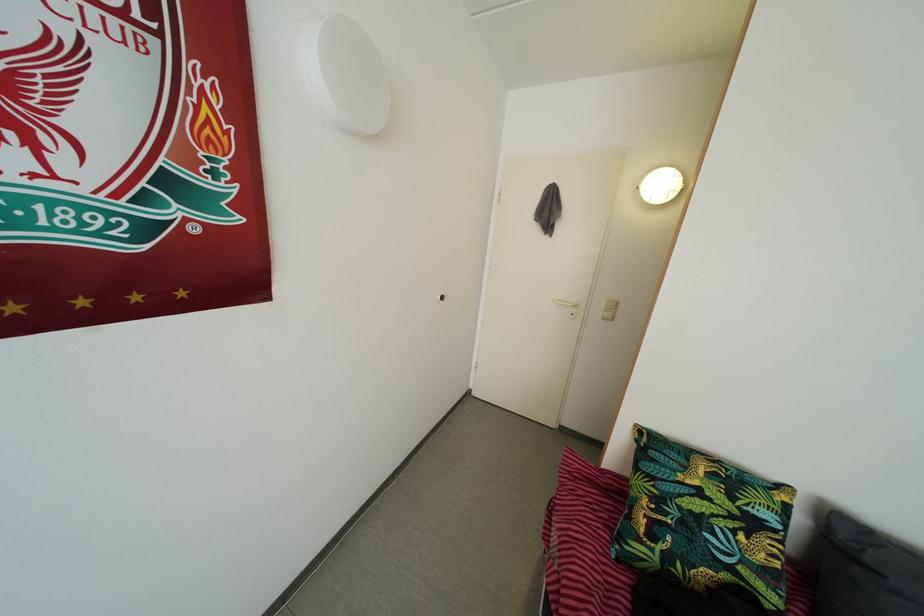
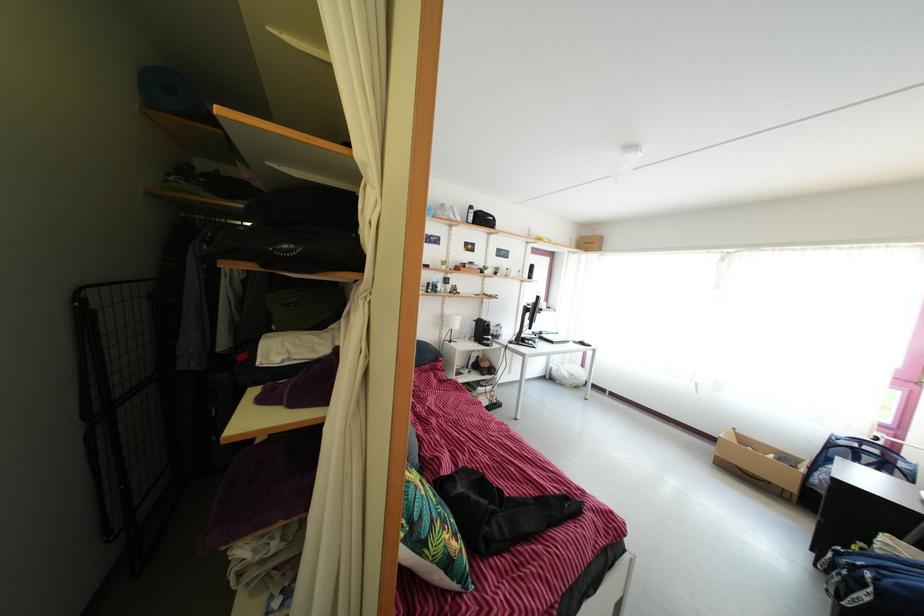
The point at (659, 485) is marked in the first image. Where is the corresponding point in the second image?

(439, 531)